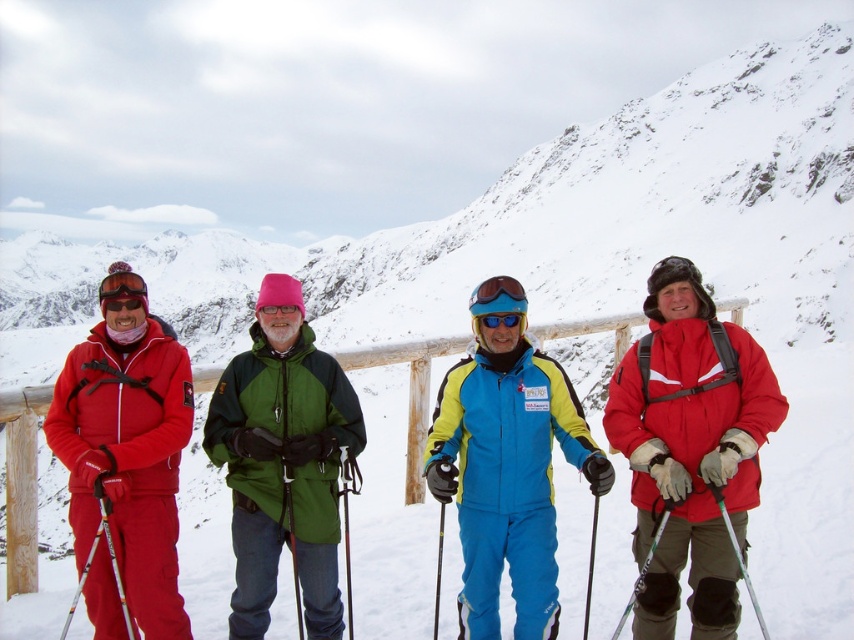
Question: Which point is closer to the camera taking this photo?

Choices:
 (A) (102, 500)
 (B) (469, 300)

Answer: (A)

Question: Is matte red ski jacket at right thinner than blue matte goggles at center?

Choices:
 (A) yes
 (B) no

Answer: (B)

Question: Which point is farther to the camera?

Choices:
 (A) (135, 282)
 (B) (715, 326)
 (C) (641, 579)
 (D) (484, 316)

Answer: (D)

Question: Does green matte jacket at center come in front of metallic silver ski pole at lower right?

Choices:
 (A) yes
 (B) no

Answer: (B)

Question: Which of the following is the farthest from the observer?

Choices:
 (A) (724, 508)
 (B) (667, 518)
 (C) (114, 604)
 (D) (703, 508)

Answer: (B)

Question: Is green matte jacket at center thinner than blue reflective goggles at center?

Choices:
 (A) no
 (B) yes

Answer: (A)